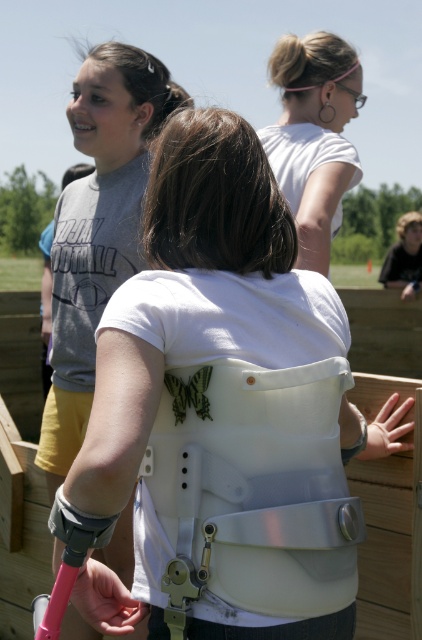
Consider the image. You are organizing a clothing donation drive and have to decide whether the white matte brace at center can fit into a donation box designed for small items. The box can only accommodate items smaller than the white matte shirt at upper center. Based on the scene description, will the brace fit?

The white matte brace at center has a smaller size compared to the white matte shirt at upper center, so it will fit into the donation box designed for small items.

You are a photographer trying to capture a closeup of the white matte brace at center and the white matte shirt at upper center in the image. Given that your camera can only focus on objects within 24 inches of each other, will you be able to get a clear photo of both items at the same time?

The white matte brace at center and white matte shirt at upper center are 26.37 inches apart from each other. Since the camera requires objects to be within 24 inches for clear focus, the distance exceeds the limit, so you cannot capture both in focus simultaneously.